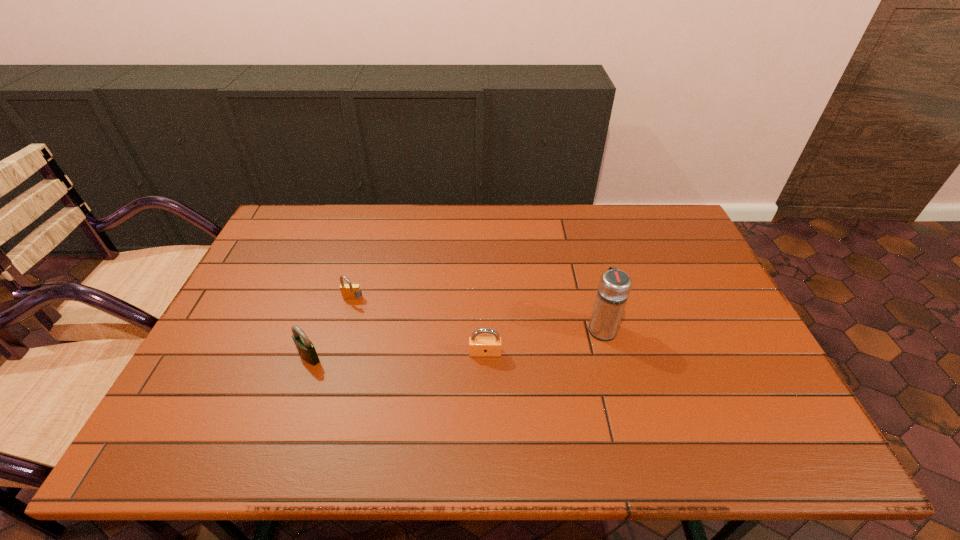
Find the location of `the tallest object`. the tallest object is located at coordinates (614, 287).

I want to click on the second farthest object, so click(614, 287).

Identify the location of the tallest padlock. Image resolution: width=960 pixels, height=540 pixels. (306, 349).

Image resolution: width=960 pixels, height=540 pixels. I want to click on the leftmost padlock, so click(306, 349).

At what (x,y) coordinates should I click in order to perform the action: click on the farthest padlock. Please return your answer as a coordinate pair (x, y). The image size is (960, 540). Looking at the image, I should click on (349, 291).

Locate an element on the screen. The image size is (960, 540). the second object from left to right is located at coordinates (349, 291).

You are a GUI agent. You are given a task and a screenshot of the screen. Output one action in this format:
    pyautogui.click(x=<x>, y=<y>)
    Task: Click on the rightmost padlock
    This screenshot has height=540, width=960.
    Given the screenshot: What is the action you would take?
    pyautogui.click(x=478, y=346)

Locate an element on the screen. free space located 0.080m with a handle on the side of the rightmost object is located at coordinates (593, 294).

Identify the location of free region located 0.140m with a handle on the side of the rightmost object. This screenshot has width=960, height=540. (589, 280).

Find the location of a particular element. This screenshot has height=540, width=960. free space located with a handle on the side of the rightmost object is located at coordinates (576, 231).